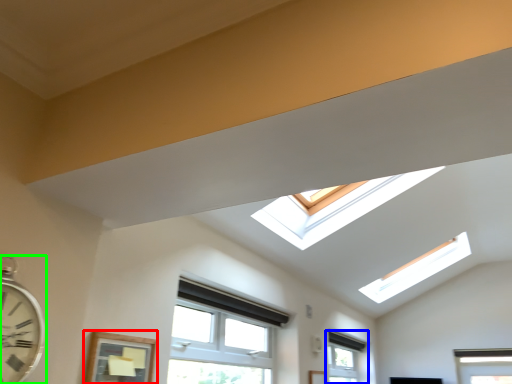
Question: Estimate the real-world distances between objects in this image. Which object is closer to window (highlighted by a red box), window (highlighted by a blue box) or clock (highlighted by a green box)?

Choices:
 (A) window
 (B) clock

Answer: (B)